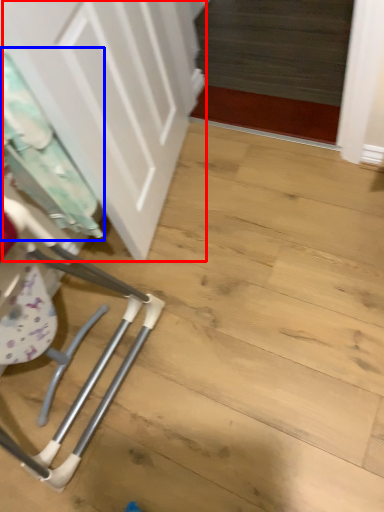
Question: Which of the following is the closest to the observer, door (highlighted by a red box) or laundry (highlighted by a blue box)?

Choices:
 (A) door
 (B) laundry

Answer: (A)